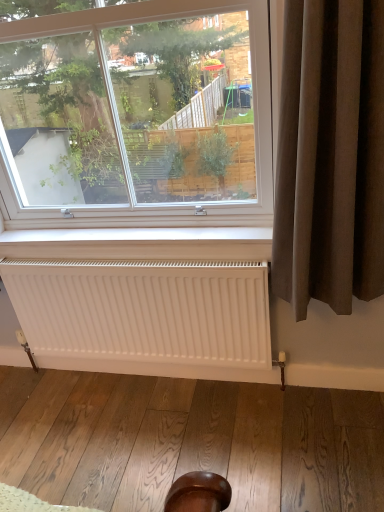
Find the location of `free spot in front of white matte radiator at lower center`. free spot in front of white matte radiator at lower center is located at coordinates (148, 438).